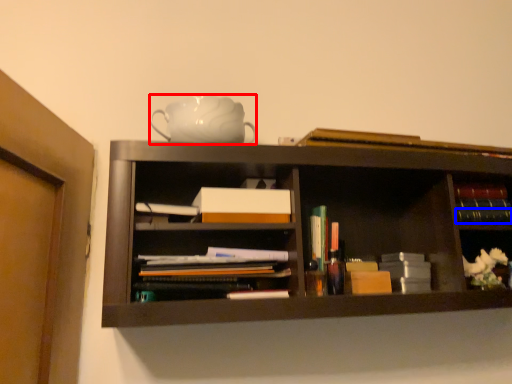
Question: Which object is further to the camera taking this photo, teapot (highlighted by a red box) or book (highlighted by a blue box)?

Choices:
 (A) teapot
 (B) book

Answer: (B)